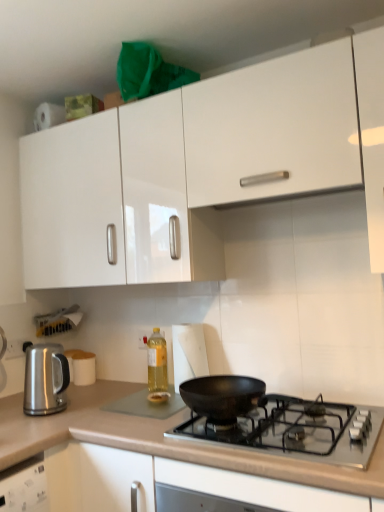
This screenshot has height=512, width=384. Identify the location of white matte cup at center-left. (81, 366).

Identify the location of white glossy cabinet at upper center. The height and width of the screenshot is (512, 384). (202, 165).

Describe the element at coordinates (157, 362) in the screenshot. The image size is (384, 512). I see `translucent yellow liquid at center` at that location.

Describe the element at coordinates (188, 353) in the screenshot. The image size is (384, 512). I see `white paper towel at center` at that location.

Find the location of a particular element. The height and width of the screenshot is (512, 384). black matte pan at center is located at coordinates (294, 430).

Find the location of a particular element. cabinetry on the left of white paper towel at center is located at coordinates (202, 165).

Considering the relative sizes of white paper towel at center and white glossy cabinet at upper center in the image provided, is white paper towel at center wider than white glossy cabinet at upper center?

No.

From the image's perspective, relative to white glossy cabinet at upper center, is white paper towel at center above or below?

Based on their image positions, white paper towel at center is located beneath white glossy cabinet at upper center.

Does satin metallic kettle at left have a larger size compared to black matte pan at center?

No.

Which point is more distant from viewer, (44, 368) or (168, 430)?

The point (44, 368) is behind.

Is satin metallic kettle at left taller than black matte pan at center?

Indeed, satin metallic kettle at left has a greater height compared to black matte pan at center.

Is satin metallic kettle at left positioned in front of black matte pan at center?

No, satin metallic kettle at left is behind black matte pan at center.

From the image's perspective, is satin metallic kettle at left positioned above or below white glossy cabinet at upper center?

From the image's perspective, satin metallic kettle at left appears below white glossy cabinet at upper center.

In the scene shown: Which of these two, satin metallic kettle at left or white glossy cabinet at upper center, is smaller?

Smaller between the two is satin metallic kettle at left.

Which of these two, satin metallic kettle at left or white glossy cabinet at upper center, is wider?

With larger width is white glossy cabinet at upper center.

Would you consider white glossy cabinet at upper center to be distant from translucent yellow liquid at center?

white glossy cabinet at upper center is near translucent yellow liquid at center, not far away.

Identify the location of cabinetry located in front of the translucent yellow liquid at center. The width and height of the screenshot is (384, 512). (202, 165).

Between white glossy cabinet at upper center and translucent yellow liquid at center, which one appears on the left side from the viewer's perspective?

Positioned to the left is translucent yellow liquid at center.

Choose the correct answer: Is white glossy cabinet at upper center inside translucent yellow liquid at center or outside it?

white glossy cabinet at upper center is spatially situated outside translucent yellow liquid at center.

Is the depth of white paper towel at center less than that of black matte pan at center?

No, white paper towel at center is behind black matte pan at center.

In terms of height, does white paper towel at center look taller or shorter compared to black matte pan at center?

white paper towel at center is taller than black matte pan at center.

Between white paper towel at center and black matte pan at center, which one has smaller size?

white paper towel at center is smaller.

Is point (197, 350) in front of point (334, 460)?

No, (197, 350) is behind (334, 460).

Between point (209, 450) and point (81, 356), which one is positioned behind?

The point (81, 356) is farther.

How far apart are smooth beige countertop at lower center and white matte cup at center-left?

smooth beige countertop at lower center and white matte cup at center-left are 67.42 centimeters apart from each other.

In the scene shown: Is smooth beige countertop at lower center positioned behind white matte cup at center-left?

No, it is in front of white matte cup at center-left.

Is smooth beige countertop at lower center looking in the opposite direction of white matte cup at center-left?

No, smooth beige countertop at lower center is not facing away from white matte cup at center-left.

Looking at the image, does black matte pan at center seem bigger or smaller compared to white glossy cabinet at upper center?

Clearly, black matte pan at center is smaller in size than white glossy cabinet at upper center.

From a real-world perspective, is black matte pan at center located beneath white glossy cabinet at upper center?

Indeed, from a real-world perspective, black matte pan at center is positioned beneath white glossy cabinet at upper center.

Would you say white glossy cabinet at upper center is part of black matte pan at center's contents?

That's incorrect, white glossy cabinet at upper center is not inside black matte pan at center.

Who is shorter, black matte pan at center or white glossy cabinet at upper center?

black matte pan at center is shorter.

The width and height of the screenshot is (384, 512). Identify the location of cabinetry in front of the white paper towel at center. (202, 165).

Where is `kitchen appliance above the black matte pan at center (from a real-world perspective)`? kitchen appliance above the black matte pan at center (from a real-world perspective) is located at coordinates (45, 379).

When comparing their distances from satin metallic kettle at left, does translucent yellow liquid at center or white paper towel at center seem further?

white paper towel at center is positioned further to the anchor satin metallic kettle at left.

Estimate the real-world distances between objects in this image. Which object is further from satin metallic kettle at left, smooth beige countertop at lower center or white matte cup at center-left?

white matte cup at center-left lies further to satin metallic kettle at left than the other object.

Looking at this image, estimate the real-world distances between objects in this image. Which object is further from white matte cup at center-left, satin metallic kettle at left or white paper towel at center?

Based on the image, white paper towel at center appears to be further to white matte cup at center-left.

Based on the photo, estimate the real-world distances between objects in this image. Which object is further from smooth beige countertop at lower center, satin metallic kettle at left or white matte cup at center-left?

Among the two, white matte cup at center-left is located further to smooth beige countertop at lower center.

Based on their spatial positions, is black matte pan at center or white paper towel at center further from translucent yellow liquid at center?

black matte pan at center is positioned further to the anchor translucent yellow liquid at center.

Estimate the real-world distances between objects in this image. Which object is closer to black matte pan at center, satin metallic kettle at left or white matte cup at center-left?

Among the two, satin metallic kettle at left is located nearer to black matte pan at center.

Looking at the image, which one is located further to white paper towel at center, smooth beige countertop at lower center or translucent yellow liquid at center?

smooth beige countertop at lower center.

Looking at the image, which one is located closer to black matte pan at center, white paper towel at center or smooth beige countertop at lower center?

Among the two, smooth beige countertop at lower center is located nearer to black matte pan at center.

Locate an element on the screen. gas stove between smooth beige countertop at lower center and white matte cup at center-left in the front-back direction is located at coordinates (294, 430).

You are a GUI agent. You are given a task and a screenshot of the screen. Output one action in this format:
    pyautogui.click(x=<x>, y=<y>)
    Task: Click on the kitchen appliance between white glossy cabinet at upper center and white matte cup at center-left in the vertical direction
    The image size is (384, 512).
    Given the screenshot: What is the action you would take?
    (45, 379)

The width and height of the screenshot is (384, 512). In order to click on paper towel positioned between smooth beige countertop at lower center and translucent yellow liquid at center from near to far in this screenshot , I will do `click(188, 353)`.

Find the location of a particular element. kitchen appliance between smooth beige countertop at lower center and white paper towel at center in the front-back direction is located at coordinates (45, 379).